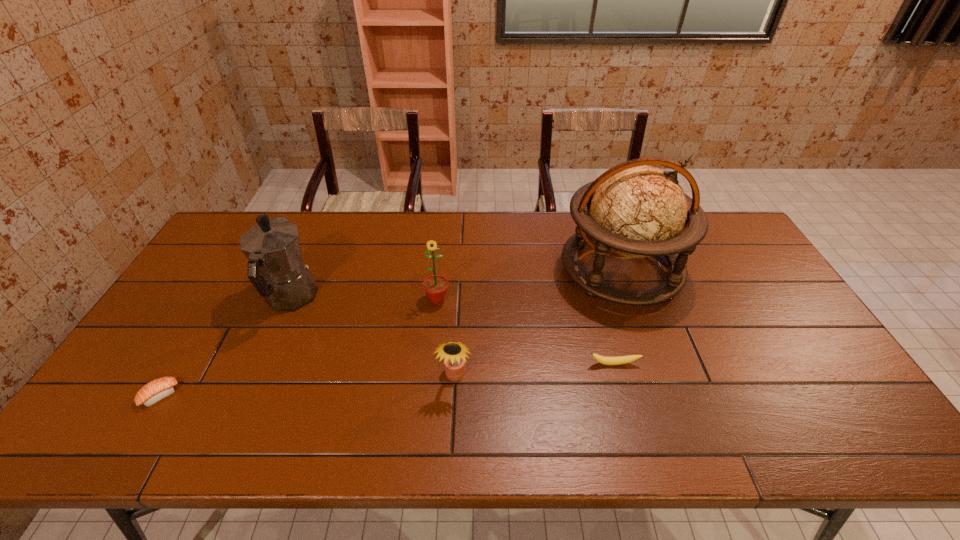
In order to click on the tallest object in this screenshot , I will do `click(633, 210)`.

The height and width of the screenshot is (540, 960). I want to click on coffeepot, so click(275, 267).

Locate an element on the screen. the second object from left to right is located at coordinates (275, 267).

At what (x,y) coordinates should I click in order to perform the action: click on the farther sunflower. Please return your answer as a coordinate pair (x, y). Looking at the image, I should click on (435, 286).

Identify the location of the fourth shortest object. The width and height of the screenshot is (960, 540). (435, 286).

Locate an element on the screen. the shorter sunflower is located at coordinates (454, 353).

Where is `the nearer sunflower`? The image size is (960, 540). the nearer sunflower is located at coordinates (454, 353).

Find the location of `banana`. banana is located at coordinates (604, 360).

Find the location of a particular element. The image size is (960, 540). sushi is located at coordinates (156, 390).

Locate an element on the screen. the shortest object is located at coordinates (156, 390).